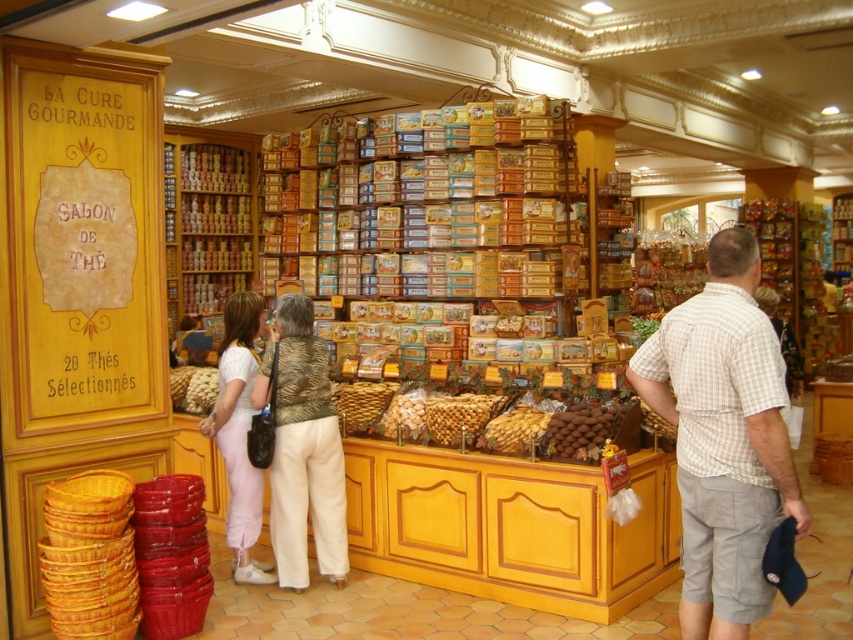
Question: Does matte white pants at center lie behind brown chocolate at center?

Choices:
 (A) yes
 (B) no

Answer: (A)

Question: Which point is farther from the camera taking this photo?

Choices:
 (A) (608, 416)
 (B) (691, 570)
 (C) (202, 426)

Answer: (C)

Question: Among these objects, which one is nearest to the camera?

Choices:
 (A) matte white pants at center
 (B) brown chocolate at center

Answer: (B)

Question: Can you confirm if plaid cotton shirt at center is positioned to the left of brown chocolate at center?

Choices:
 (A) no
 (B) yes

Answer: (A)

Question: Can you confirm if plaid cotton shirt at center is positioned below matte white pants at center?

Choices:
 (A) yes
 (B) no

Answer: (B)

Question: Estimate the real-world distances between objects in this image. Which object is closer to the plaid cotton shirt at center?

Choices:
 (A) brown chocolate at center
 (B) matte white pants at center

Answer: (A)